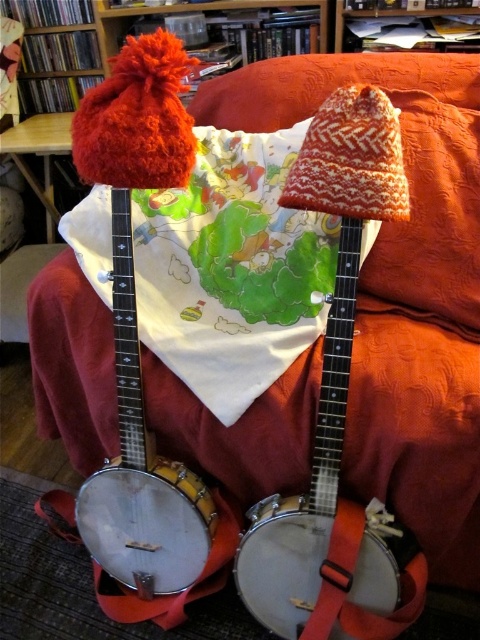
Question: Is matte white banjo at center positioned behind white wooden banjo at center?

Choices:
 (A) yes
 (B) no

Answer: (B)

Question: Which point is closer to the camera?

Choices:
 (A) matte white banjo at center
 (B) white wooden banjo at center

Answer: (A)

Question: Can you confirm if matte white banjo at center is thinner than white wooden banjo at center?

Choices:
 (A) yes
 (B) no

Answer: (B)

Question: Among these objects, which one is farthest from the camera?

Choices:
 (A) matte white banjo at center
 (B) white wooden banjo at center

Answer: (B)

Question: Is matte white banjo at center above white wooden banjo at center?

Choices:
 (A) yes
 (B) no

Answer: (A)